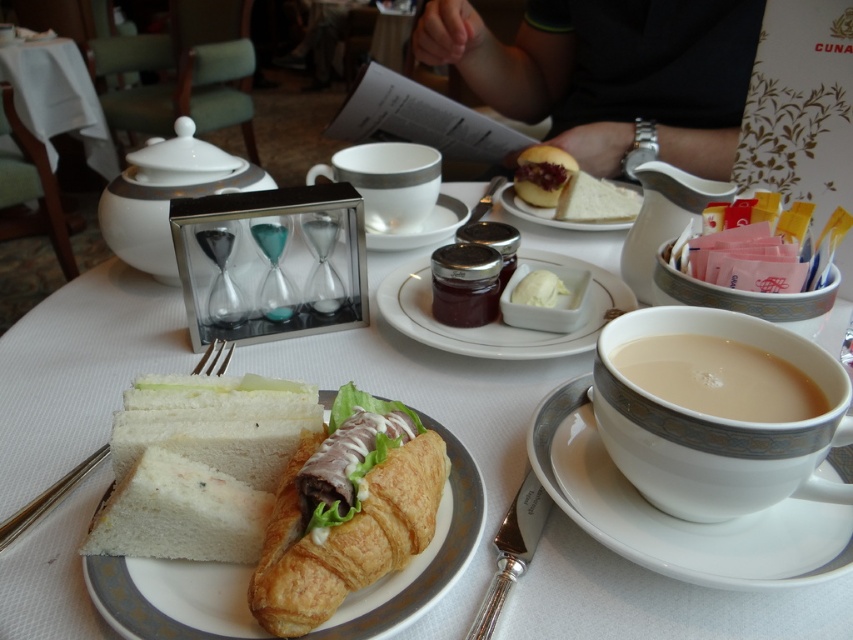
Question: Can you confirm if white porcelain cup at right is positioned to the left of smooth cream cheese spread at center?

Choices:
 (A) no
 (B) yes

Answer: (A)

Question: Is silvermetallicfork at left wider than white porcelain saucer at center?

Choices:
 (A) no
 (B) yes

Answer: (A)

Question: Considering the real-world distances, which object is farthest from the white creamy butter at center?

Choices:
 (A) white porcelain cup at upper center
 (B) white ceramic saucer at right

Answer: (A)

Question: Which point is closer to the camera?

Choices:
 (A) (584, 394)
 (B) (480, 353)
 (C) (552, 156)
 (D) (519, 572)

Answer: (D)

Question: Which object is positioned farthest from the brown liquid at right?

Choices:
 (A) silvermetallicfork at left
 (B) smooth cream cheese spread at center
 (C) white ceramic sugar bowl at upper left

Answer: (B)

Question: Is brown liquid at right wider than polished metal knife at lower right?

Choices:
 (A) yes
 (B) no

Answer: (A)